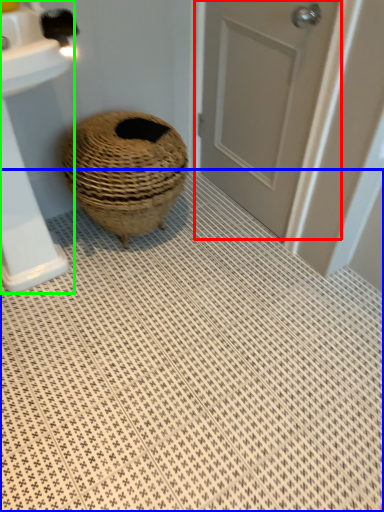
Question: Which object is the closest to the door (highlighted by a red box)? Choose among these: bath mat (highlighted by a blue box) or sink (highlighted by a green box).

Choices:
 (A) bath mat
 (B) sink

Answer: (A)